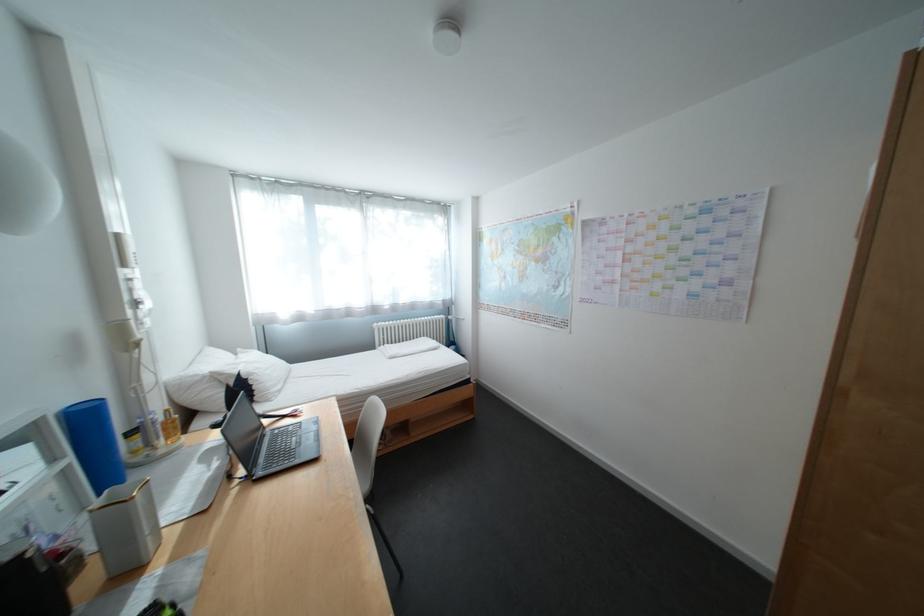
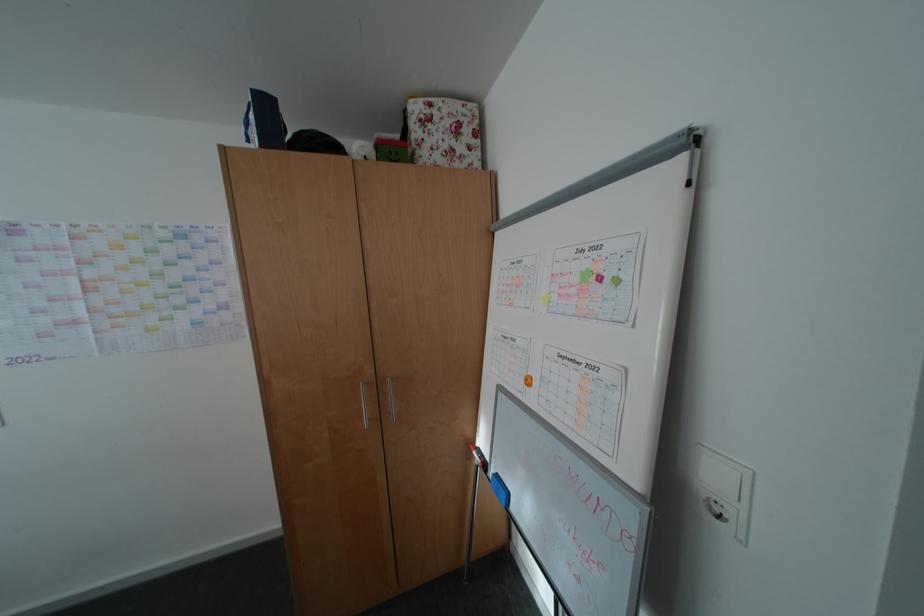
Question: The camera is either moving clockwise (left) or counter-clockwise (right) around the object. The first image is from the beginning of the video and the second image is from the end. Is the camera moving left or right when shooting the video?

Choices:
 (A) Left
 (B) Right

Answer: (A)